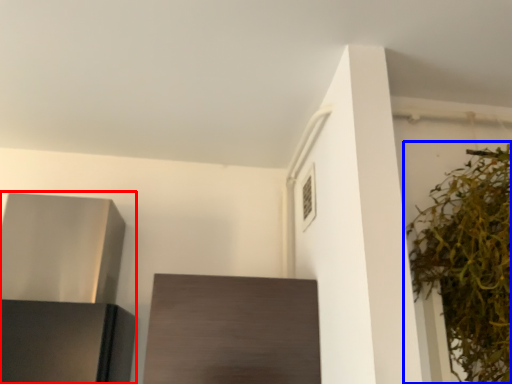
Question: Which point is closer to the camera, appliance (highlighted by a red box) or houseplant (highlighted by a blue box)?

Choices:
 (A) appliance
 (B) houseplant

Answer: (B)